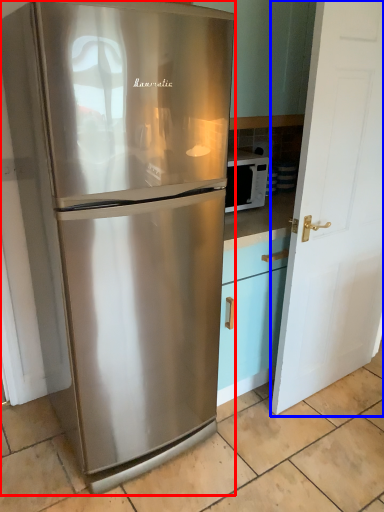
Question: Which object is further to the camera taking this photo, refrigerator (highlighted by a red box) or door (highlighted by a blue box)?

Choices:
 (A) refrigerator
 (B) door

Answer: (B)